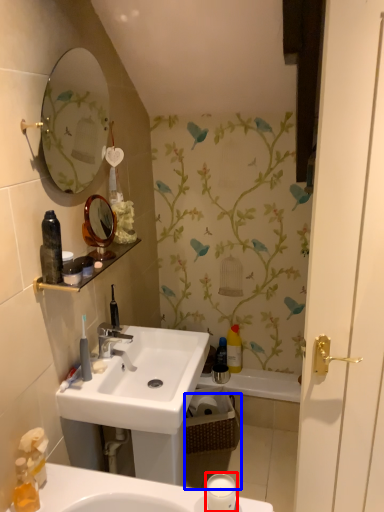
Question: Which object is further to the camera taking this photo, candle holder (highlighted by a red box) or basket (highlighted by a blue box)?

Choices:
 (A) candle holder
 (B) basket

Answer: (B)